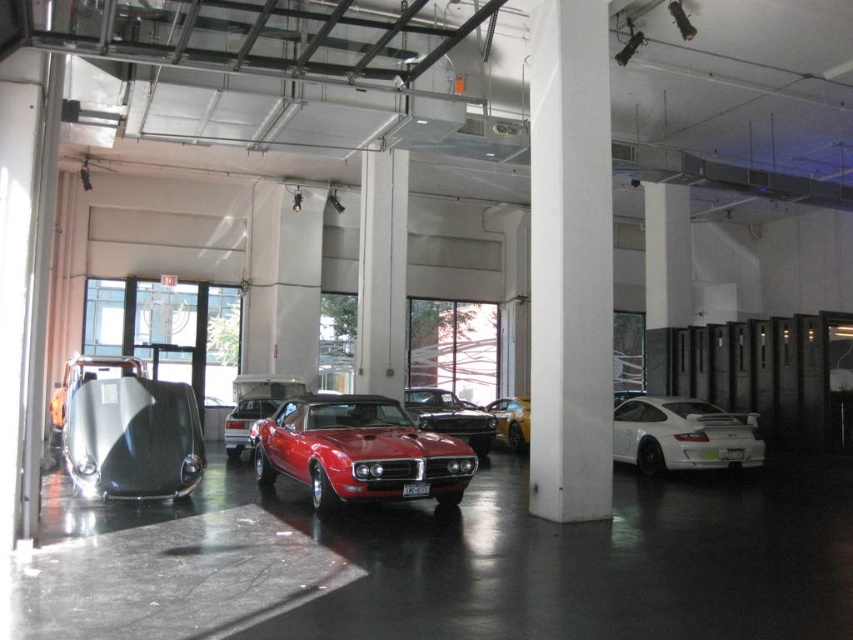
Measure the distance between shiny red car at center and white glossy sports car at right.

18.41 feet

Which is above, shiny red car at center or white glossy sports car at right?

shiny red car at center is higher up.

Who is more distant from viewer, (338, 445) or (693, 467)?

The point (693, 467) is behind.

The image size is (853, 640). What are the coordinates of `shiny red car at center` in the screenshot? It's located at (358, 451).

Can you confirm if white glossy sports car at right is wider than shiny black car at center?

Correct, the width of white glossy sports car at right exceeds that of shiny black car at center.

Which is above, white glossy sports car at right or shiny black car at center?

white glossy sports car at right is higher up.

The height and width of the screenshot is (640, 853). What are the coordinates of `white glossy sports car at right` in the screenshot? It's located at (683, 435).

Does point (349, 467) come in front of point (523, 419)?

Yes, point (349, 467) is in front of point (523, 419).

Is shiny red car at center wider than metallic yellow car at center?

Yes.

Identify the location of shiny red car at center. (358, 451).